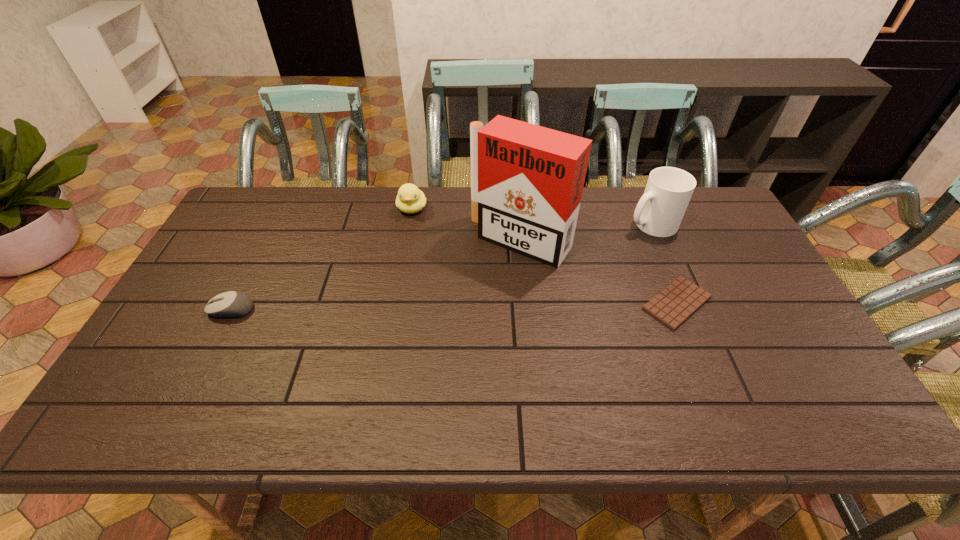
Find the location of a particular element. The image size is (960, 540). vacant spot on the desktop that is between the computer equipment and the chocolate bar and is positioned on the front-facing side of the tallest object is located at coordinates (468, 306).

Locate an element on the screen. The image size is (960, 540). free space on the desktop that is between the second shortest object and the chocolate bar and is positioned at the beak of the second object from left to right is located at coordinates (397, 307).

Find the location of a particular element. This screenshot has height=540, width=960. vacant space on the desktop that is between the leftmost object and the shortest object and is positioned on the handle side of the mug is located at coordinates (519, 306).